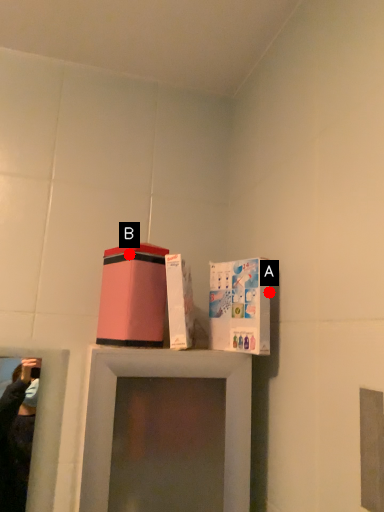
Question: Two points are circled on the image, labeled by A and B beside each circle. Which point is further to the camera?

Choices:
 (A) A is further
 (B) B is further

Answer: (B)